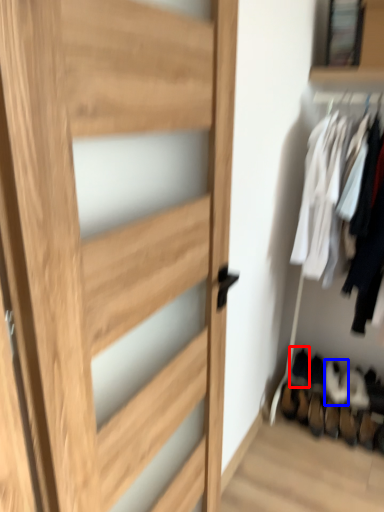
Question: Among these objects, which one is farthest to the camera, shoe (highlighted by a red box) or shoe (highlighted by a blue box)?

Choices:
 (A) shoe
 (B) shoe

Answer: (A)